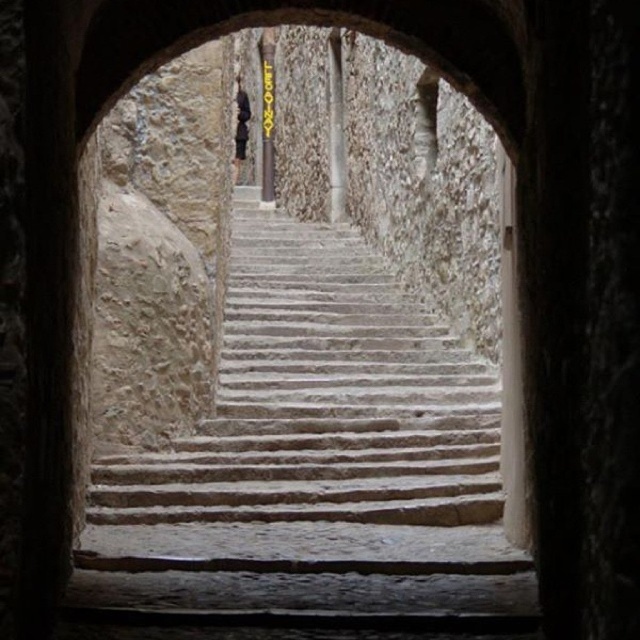
Question: Can you confirm if white stone stairs at center is thinner than dark fabric figure at center?

Choices:
 (A) yes
 (B) no

Answer: (B)

Question: Which point is closer to the camera taking this photo?

Choices:
 (A) (384, 515)
 (B) (244, 157)

Answer: (A)

Question: Does white stone stairs at center appear under dark fabric figure at center?

Choices:
 (A) yes
 (B) no

Answer: (A)

Question: Which object is farther from the camera taking this photo?

Choices:
 (A) white stone stairs at center
 (B) dark fabric figure at center

Answer: (B)

Question: Which point is closer to the camera?

Choices:
 (A) dark fabric figure at center
 (B) white stone stairs at center

Answer: (B)

Question: Is white stone stairs at center smaller than dark fabric figure at center?

Choices:
 (A) no
 (B) yes

Answer: (B)